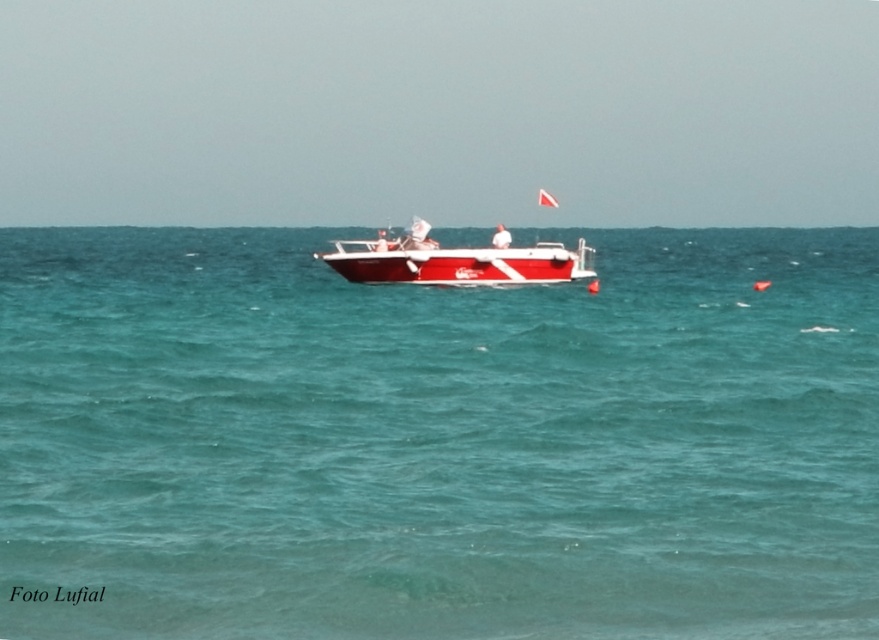
Which of these two, teal glossy water at center or shiny red boat at center, stands shorter?

With less height is teal glossy water at center.

This screenshot has width=879, height=640. What are the coordinates of `teal glossy water at center` in the screenshot? It's located at (437, 440).

I want to click on teal glossy water at center, so click(x=437, y=440).